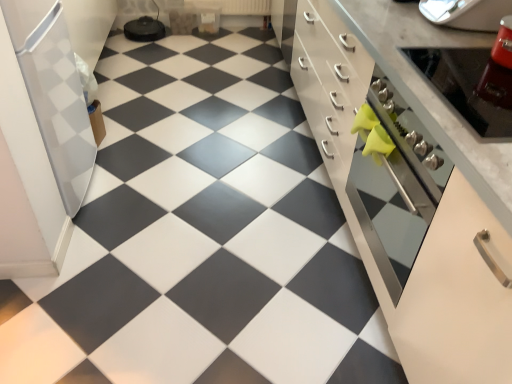
Question: Is metallic silver oven at right, which is counted as the 2th appliance, starting from the left, to the left or to the right of matte black tile at center in the image?

Choices:
 (A) right
 (B) left

Answer: (A)

Question: From a real-world perspective, is metallic silver oven at right, the 2th appliance viewed from the right, positioned above or below matte black tile at center?

Choices:
 (A) below
 (B) above

Answer: (B)

Question: Estimate the real-world distances between objects in this image. Which object is closer to the metallic silver toaster at upper right, the 1th appliance viewed from the right?

Choices:
 (A) matte black tile at center
 (B) white glossy refrigerator at left, marked as the 1th appliance in a left-to-right arrangement
 (C) metallic silver oven at right
 (D) metallic silver oven at right, which is counted as the 2th appliance, starting from the left
 (E) white glossy cabinet at center

Answer: (D)

Question: Which of these objects is positioned farthest from the white glossy cabinet at center?

Choices:
 (A) white glossy refrigerator at left, positioned as the 3th appliance in right-to-left order
 (B) metallic silver oven at right, the 2th appliance viewed from the right
 (C) matte black tile at center
 (D) metallic silver oven at right
 (E) metallic silver toaster at upper right, the 1th appliance viewed from the right

Answer: (A)